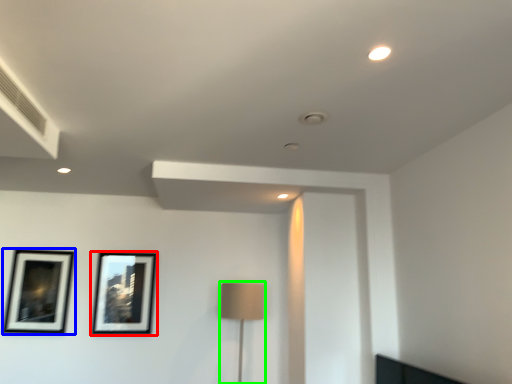
Question: Which object is the closest to the picture frame (highlighted by a red box)? Choose among these: picture frame (highlighted by a blue box) or table lamp (highlighted by a green box).

Choices:
 (A) picture frame
 (B) table lamp

Answer: (A)